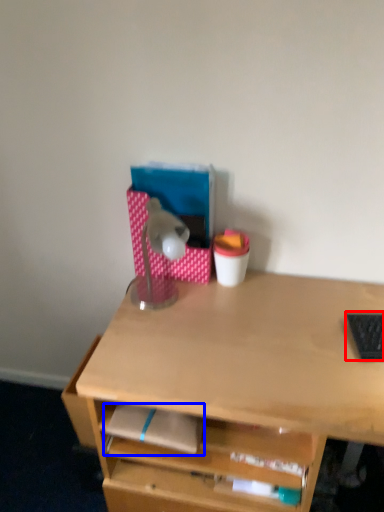
Question: Which point is closer to the camera, laptop keyboard (highlighted by a red box) or notepad (highlighted by a blue box)?

Choices:
 (A) laptop keyboard
 (B) notepad

Answer: (B)